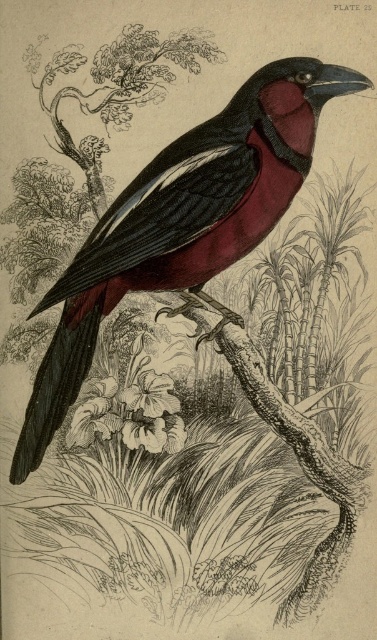
Question: Does matte black bird at center have a smaller size compared to white paper flower at center?

Choices:
 (A) no
 (B) yes

Answer: (A)

Question: Observing the image, what is the correct spatial positioning of matte black bird at center in reference to white paper flower at center?

Choices:
 (A) left
 (B) right

Answer: (B)

Question: Which object appears farthest from the camera in this image?

Choices:
 (A) white paper flower at center
 (B) matte black bird at center

Answer: (A)

Question: Which object is closer to the camera taking this photo?

Choices:
 (A) matte black bird at center
 (B) white paper flower at center

Answer: (A)

Question: Does matte black bird at center have a larger size compared to white paper flower at center?

Choices:
 (A) no
 (B) yes

Answer: (B)